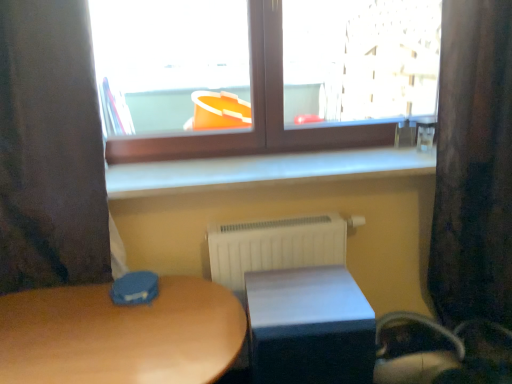
Find the location of a particular element. This screenshot has width=512, height=384. vacant area that is in front of dark fabric curtain at left, placed as the 1th curtain when sorted from left to right is located at coordinates (61, 337).